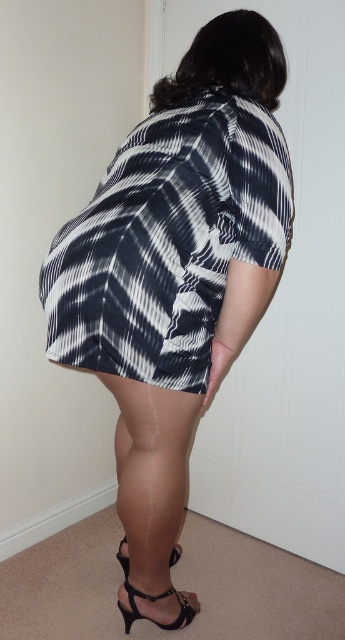
Question: Is printed fabric dress at center wider than black leather sandal at lower right?

Choices:
 (A) yes
 (B) no

Answer: (A)

Question: Among these points, which one is farthest from the camera?

Choices:
 (A) (123, 541)
 (B) (119, 189)
 (C) (127, 596)
 (D) (74, 232)

Answer: (A)

Question: Which point is closer to the camera?

Choices:
 (A) (287, 212)
 (B) (225, 282)
 (C) (150, 468)

Answer: (A)

Question: Does printed fabric dress at center appear on the right side of satin black high heels at lower center?

Choices:
 (A) no
 (B) yes

Answer: (B)

Question: Estimate the real-world distances between objects in this image. Which object is farther from the satin black high heels at lower center?

Choices:
 (A) black leather sandal at lower right
 (B) black and white striped dress at center

Answer: (B)

Question: Is satin black high heels at lower center closer to camera compared to black leather sandal at lower right?

Choices:
 (A) yes
 (B) no

Answer: (A)